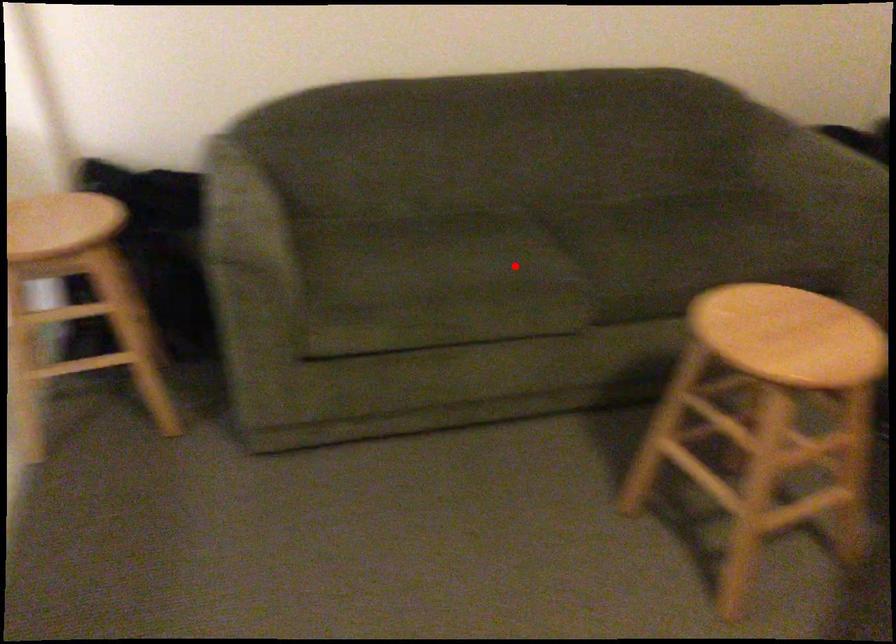
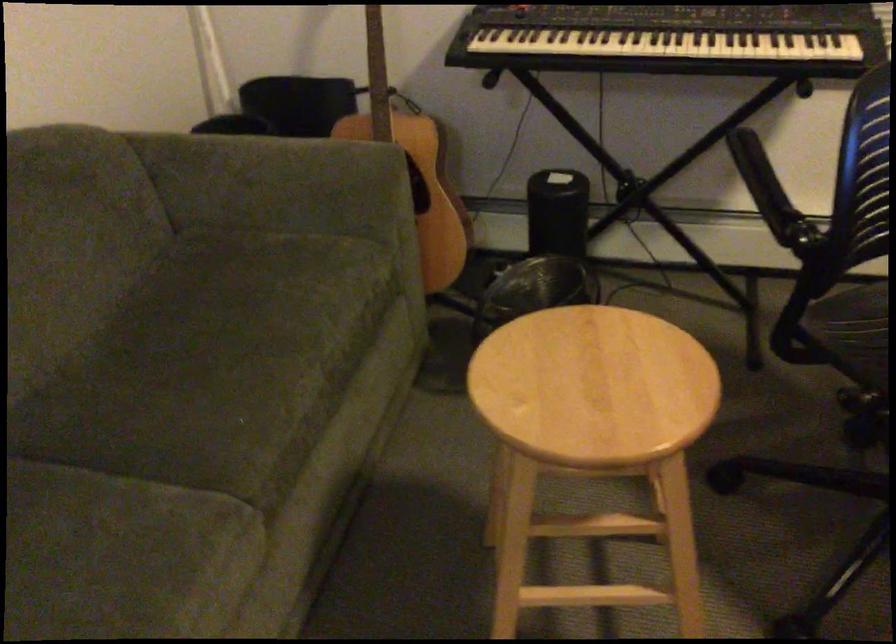
Question: I am providing you with two images of the same scene from different viewpoints. Given a red point in image1, look at the same physical point in image2. Is it:

Choices:
 (A) Closer to the viewpoint
 (B) Farther from the viewpoint

Answer: (A)